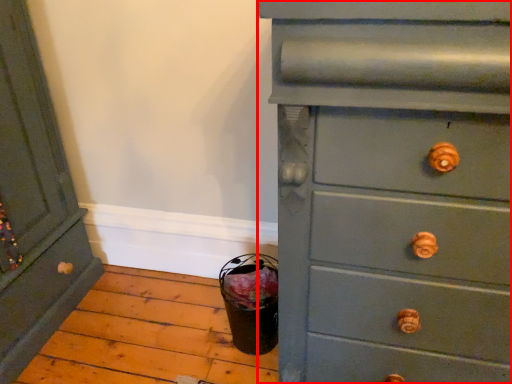
Question: Where is chest of drawers (annotated by the red box) located in relation to chest of drawers in the image?

Choices:
 (A) left
 (B) right

Answer: (B)